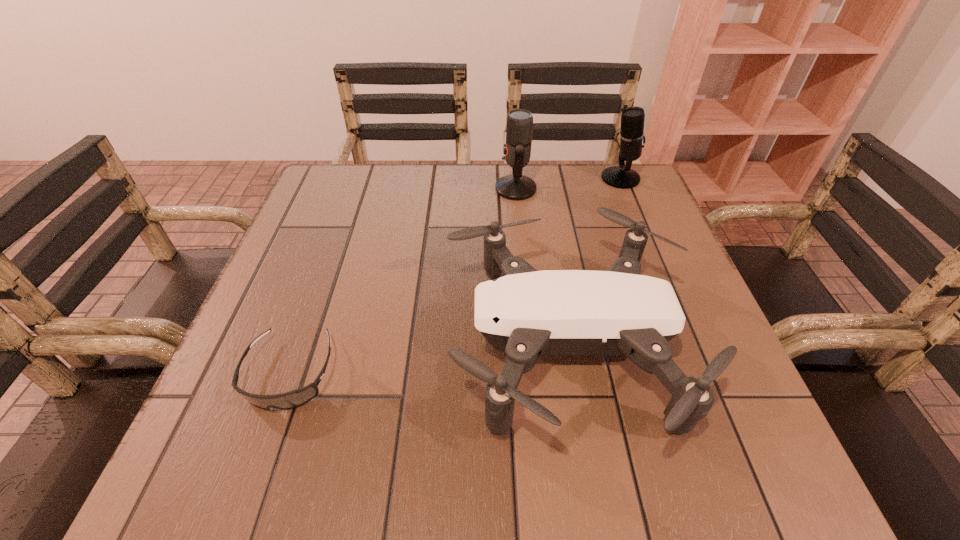
Locate an element on the screen. Image resolution: width=960 pixels, height=540 pixels. blank area at the near edge is located at coordinates (439, 441).

The height and width of the screenshot is (540, 960). Identify the location of vacant point at the left edge. (310, 244).

The height and width of the screenshot is (540, 960). In order to click on free space at the right edge of the desktop in this screenshot , I will do `click(657, 264)`.

In the image, there is a desktop. Where is `vacant region at the far right corner`? This screenshot has width=960, height=540. vacant region at the far right corner is located at coordinates (631, 212).

Locate an element on the screen. The width and height of the screenshot is (960, 540). free space between the shortest object and the right microphone is located at coordinates (x=455, y=276).

Image resolution: width=960 pixels, height=540 pixels. Find the location of `free space between the left microphone and the third tallest object`. free space between the left microphone and the third tallest object is located at coordinates (540, 266).

Locate an element on the screen. Image resolution: width=960 pixels, height=540 pixels. free space between the left microphone and the drone is located at coordinates (540, 266).

In order to click on vacant space that's between the drone and the left microphone in this screenshot , I will do `click(540, 266)`.

I want to click on vacant space in between the drone and the right microphone, so click(592, 261).

The height and width of the screenshot is (540, 960). Find the location of `free space between the third tallest object and the right microphone`. free space between the third tallest object and the right microphone is located at coordinates (592, 261).